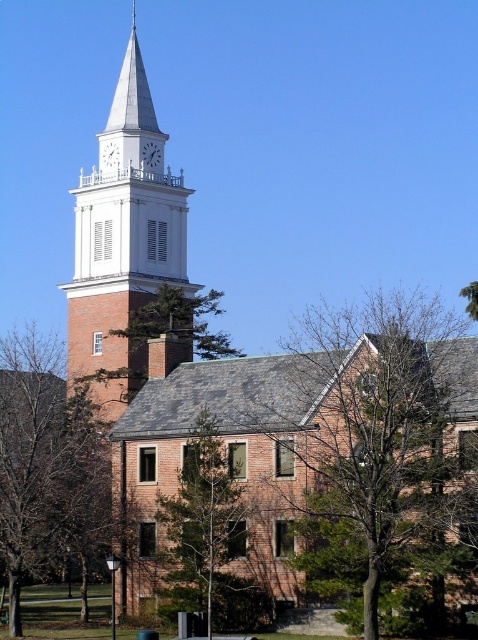
Question: Does bare branches at center have a greater width compared to green leafy tree at upper right?

Choices:
 (A) no
 (B) yes

Answer: (B)

Question: Based on their relative distances, which object is nearer to the green leafy tree at upper center?

Choices:
 (A) green leafy tree at center
 (B) green leafy tree at upper right

Answer: (A)

Question: Based on their relative distances, which object is nearer to the green leafy tree at center?

Choices:
 (A) green leafy tree at upper right
 (B) brown textured tree at lower left
 (C) bare branches at center
 (D) white brick clock tower at upper left

Answer: (C)

Question: Does green leafy tree at center appear over green leafy tree at upper right?

Choices:
 (A) yes
 (B) no

Answer: (B)

Question: Is brown textured tree at lower left above white painted wood clock at upper center?

Choices:
 (A) yes
 (B) no

Answer: (B)

Question: Which object is farther from the camera taking this photo?

Choices:
 (A) green leafy tree at center
 (B) green leafy tree at upper right
 (C) brown textured tree at lower left
 (D) white clock tower at upper center

Answer: (D)